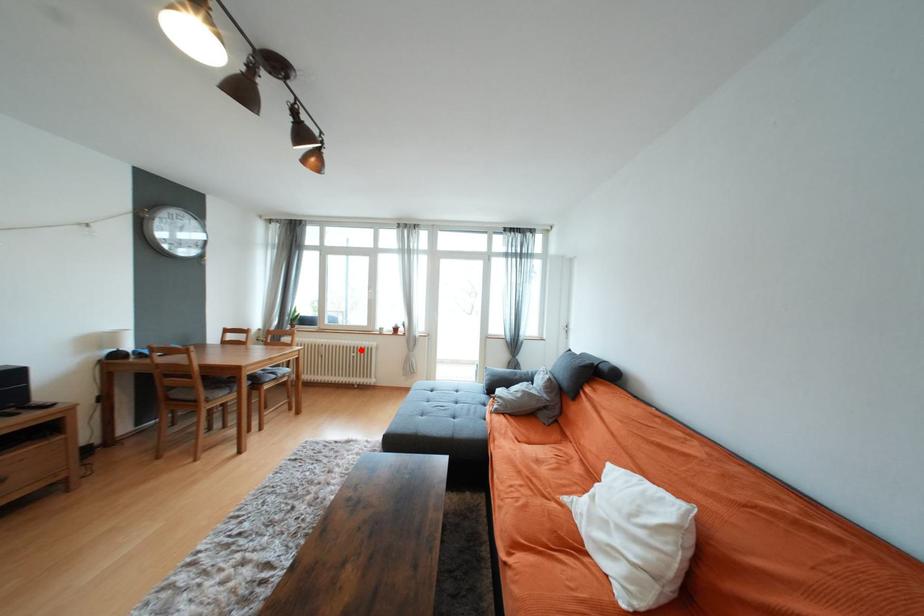
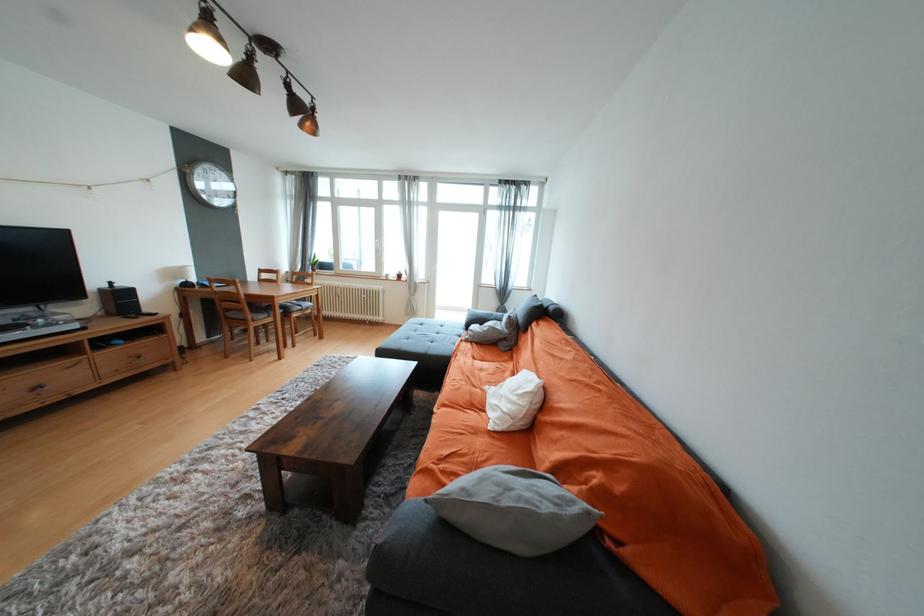
Where in the second image is the point corresponding to the highlighted location from the first image?

(371, 293)